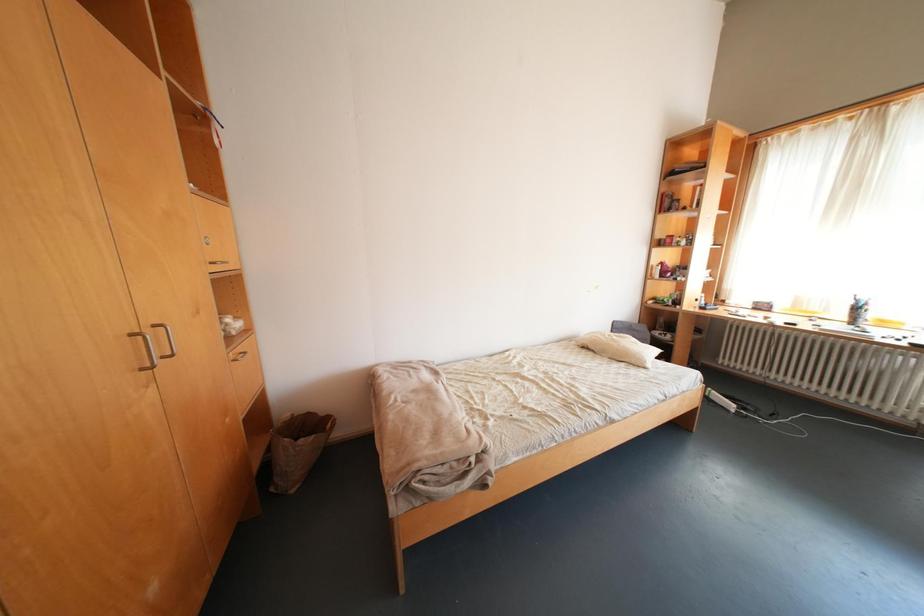
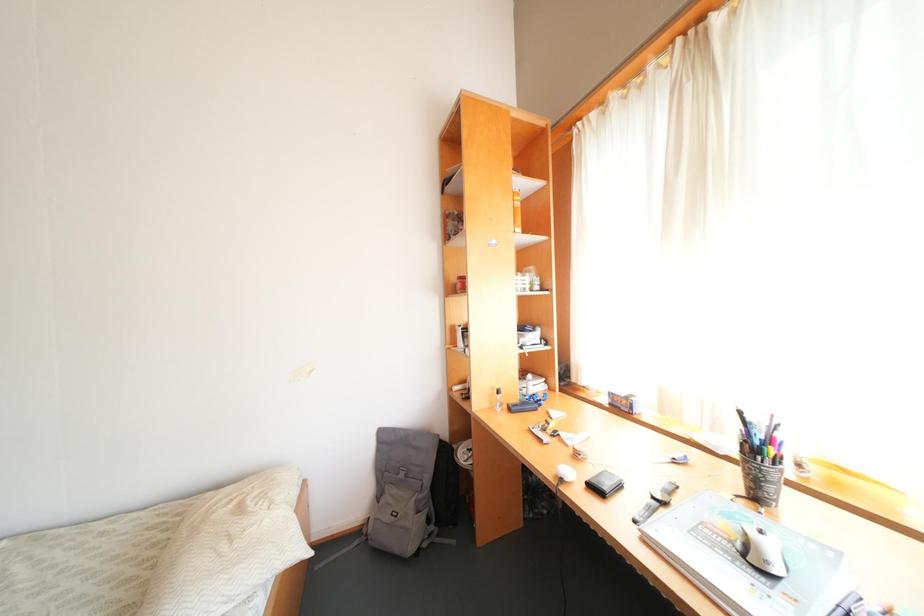
What movement of the cameraman would produce the second image?

The cameraman moved toward right, forward.